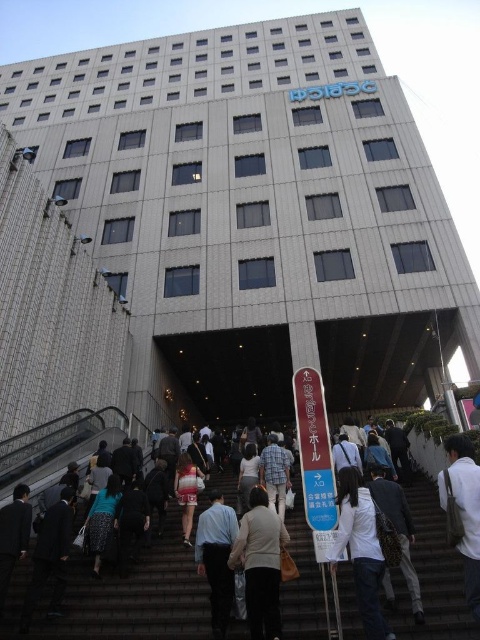
Question: Which object appears farthest from the camera in this image?

Choices:
 (A) light blue shirt at center
 (B) gray concrete stairs at center
 (C) white fabric bag at lower right
 (D) white matte shirt at center

Answer: (A)

Question: Based on their relative distances, which object is nearer to the light beige sweater at center?

Choices:
 (A) white matte shirt at center
 (B) white fabric bag at lower right
 (C) light blue shirt at center

Answer: (C)

Question: Is white matte shirt at center closer to camera compared to light blue shirt at center?

Choices:
 (A) no
 (B) yes

Answer: (B)

Question: Does white matte shirt at center have a greater width compared to light blue shirt at center?

Choices:
 (A) no
 (B) yes

Answer: (B)

Question: Which of the following is the farthest from the observer?

Choices:
 (A) (456, 524)
 (B) (264, 515)
 (C) (211, 570)

Answer: (B)

Question: Observing the image, what is the correct spatial positioning of gray concrete stairs at center in reference to light blue shirt at center?

Choices:
 (A) left
 (B) right

Answer: (B)